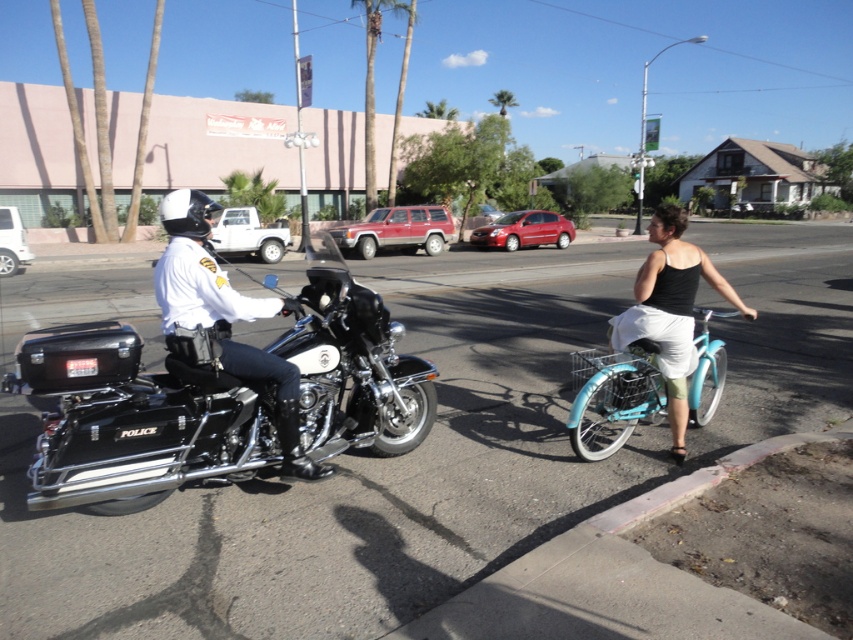
You are a pedestrian standing at the intersection observing both the black polished police motorcycle at left and the teal matte bicycle at center. Which vehicle is positioned closer to you?

The black polished police motorcycle at left is closer to the viewer than the teal matte bicycle at center.

You are a pedestrian standing on the sidewalk and see the black glossy motorcycle at left and the teal matte bicycle at center. Which vehicle appears larger in size?

The teal matte bicycle at center appears larger than the black glossy motorcycle at left.

Looking at this image, you are a pedestrian standing at the intersection and see both the black polished police motorcycle at left and the black glossy motorcycle at left. Which one is smaller in size?

The black polished police motorcycle at left is smaller in size compared to the black glossy motorcycle at left according to the description.